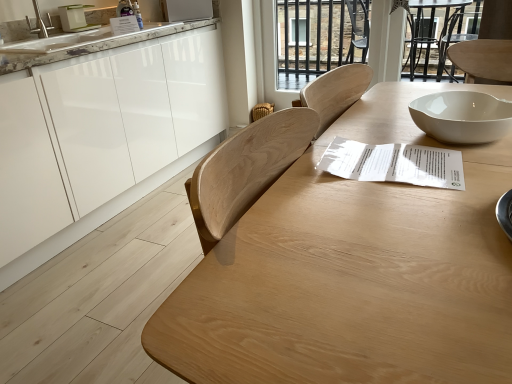
Where is `free space that is in between white glossy bowl at upper right and white paper at center`? The height and width of the screenshot is (384, 512). free space that is in between white glossy bowl at upper right and white paper at center is located at coordinates (397, 138).